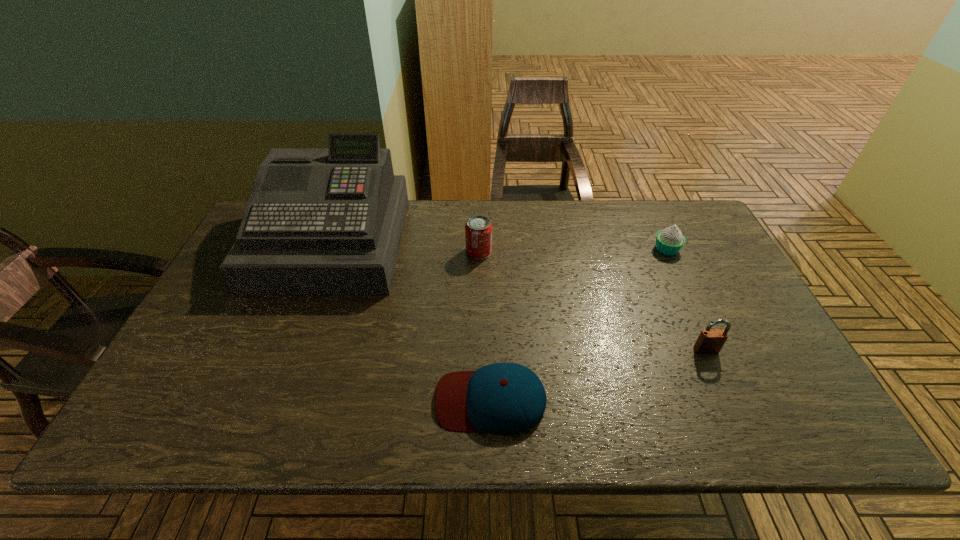
You are a GUI agent. You are given a task and a screenshot of the screen. Output one action in this format:
    pyautogui.click(x=<x>, y=<y>)
    Task: Click on the vacant position in the image that satisfies the following two spatial constraints: 1. on the front-facing side of the leftmost object; 2. on the right side of the can
    
    Given the screenshot: What is the action you would take?
    pyautogui.click(x=328, y=252)

This screenshot has width=960, height=540. Find the location of `vacant space that satisfies the following two spatial constraints: 1. on the front-facing side of the can; 2. on the left side of the tallest object`. vacant space that satisfies the following two spatial constraints: 1. on the front-facing side of the can; 2. on the left side of the tallest object is located at coordinates (328, 252).

The image size is (960, 540). I want to click on vacant region that satisfies the following two spatial constraints: 1. on the front-facing side of the fourth tallest object; 2. on the right side of the leftmost object, so click(329, 249).